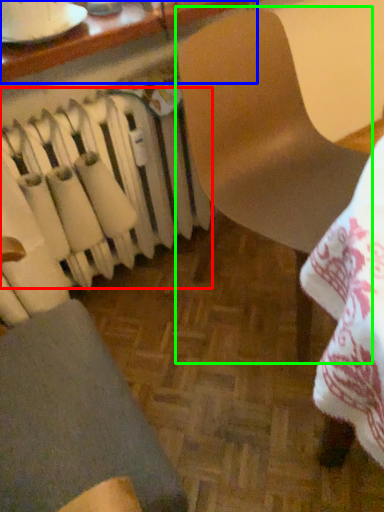
Question: Which object is the closest to the radiator (highlighted by a red box)? Choose among these: table (highlighted by a blue box) or chair (highlighted by a green box).

Choices:
 (A) table
 (B) chair

Answer: (B)